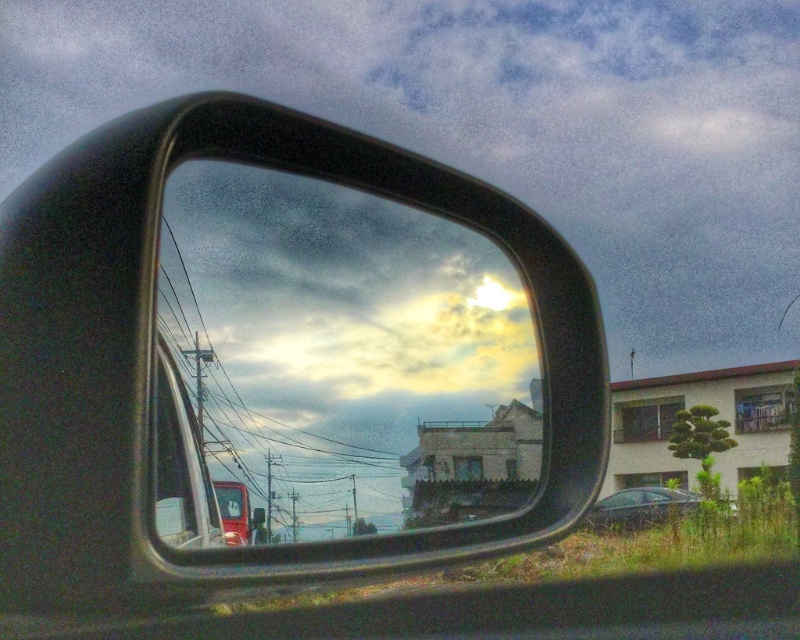
You are a delivery driver checking your side mirror to navigate a tight alley. The transparent glass mirror at center shows the cloudy sky and buildings. Based on the mirror reflection, can you determine if the buildings in the background are closer to the mirror or farther away than the cloudy sky?

The transparent glass mirror at center reflects the cloudy sky and buildings. Since mirrors reflect objects with their distance preserved, the buildings in the background are farther away from the mirror than the cloudy sky, as the sky is the farthest backdrop in the reflection.

You are driving a car and looking at the side mirror. You see the clear glass window at center and the shiny black sedan at lower right. Which object is positioned to the left in the mirror?

The clear glass window at center is positioned to the left of the shiny black sedan at lower right in the mirror.

You are a delivery person standing next to your vehicle. You need to place a 2.5 meters long ladder horizontally behind the transparent glass mirror at center without blocking the driver seat. Is there enough space?

The transparent glass mirror at center is only 1.74 meters away from the viewer. Since the ladder is 2.5 meters long, it would extend beyond the available space behind the mirror, making it impossible to place the ladder horizontally without blocking the driver seat.